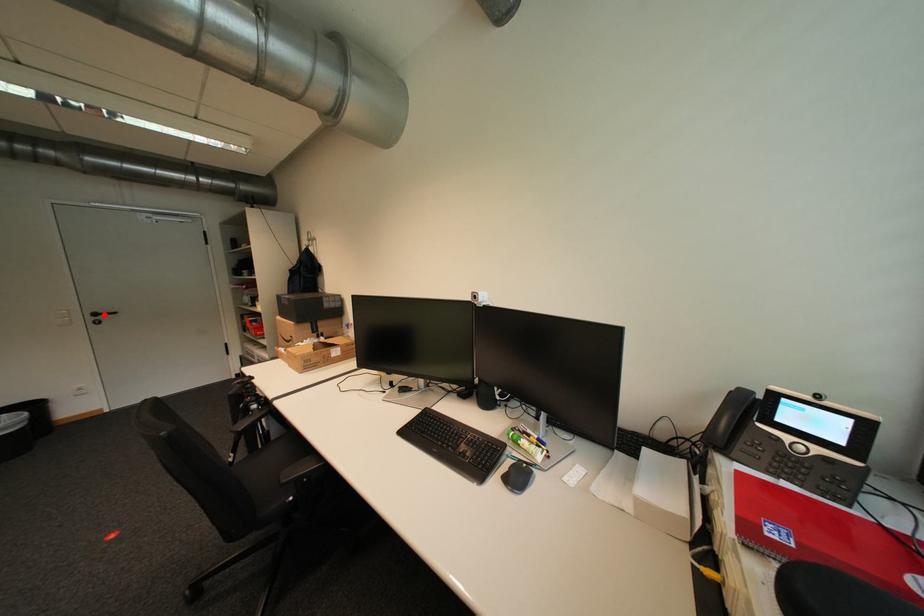
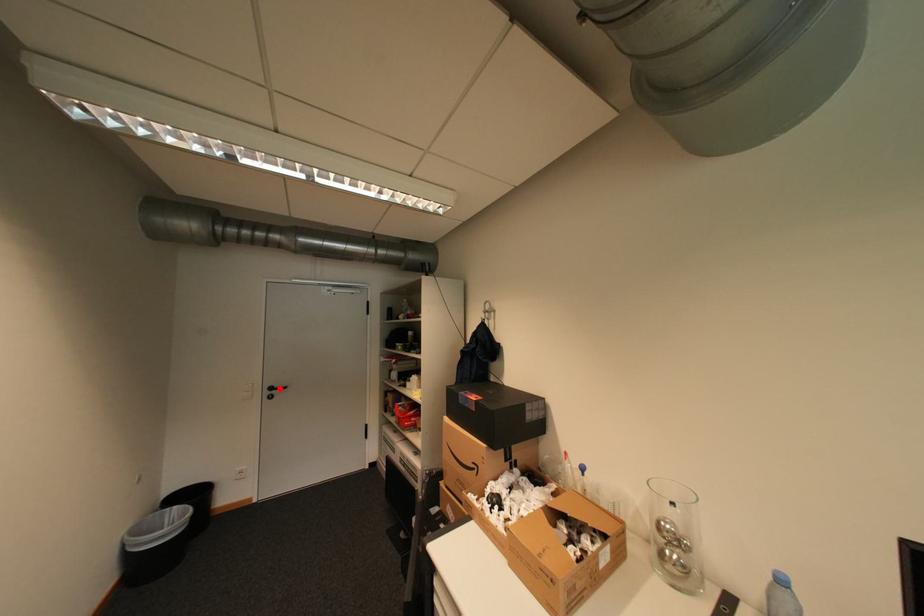
I am providing you with two images of the same scene from different viewpoints. A red point is marked on the first image and another point is marked on the second image. Is the red point in image1 aligned with the point shown in image2?

Yes